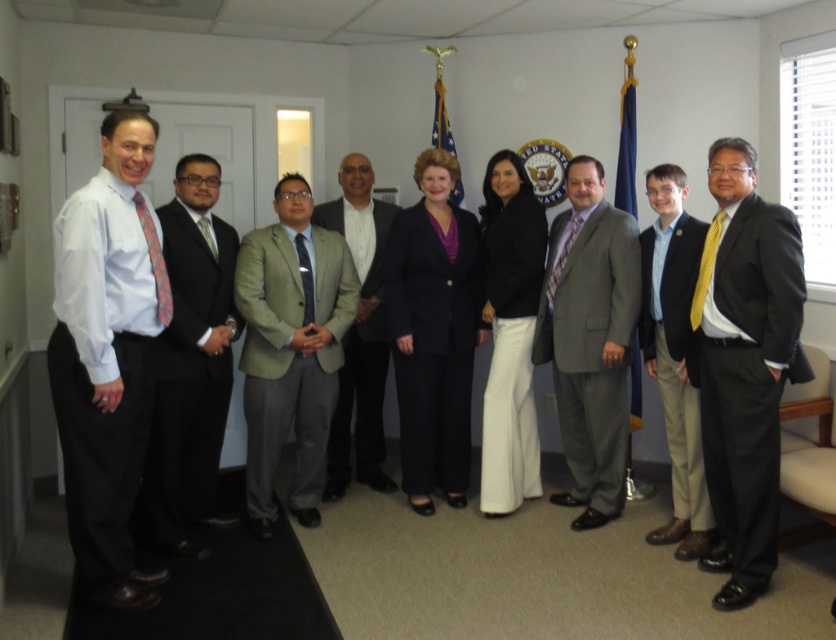
Based on the scene description, where is the dark gray suit at center located in terms of coordinates?

The dark gray suit at center is located at point coordinates of [190,365].

You are a photographer setting up for a group photo. You need to ensure there is enough space between the black matte suit at center and the light gray suit at center to avoid overlapping. The minimum required space between subjects is 18 inches. Based on the scene, will the current spacing work?

The black matte suit at center and light gray suit at center are 17.53 inches apart from each other, which is less than the required 18 inches. Therefore, the current spacing will not work as they will overlap in the photo.